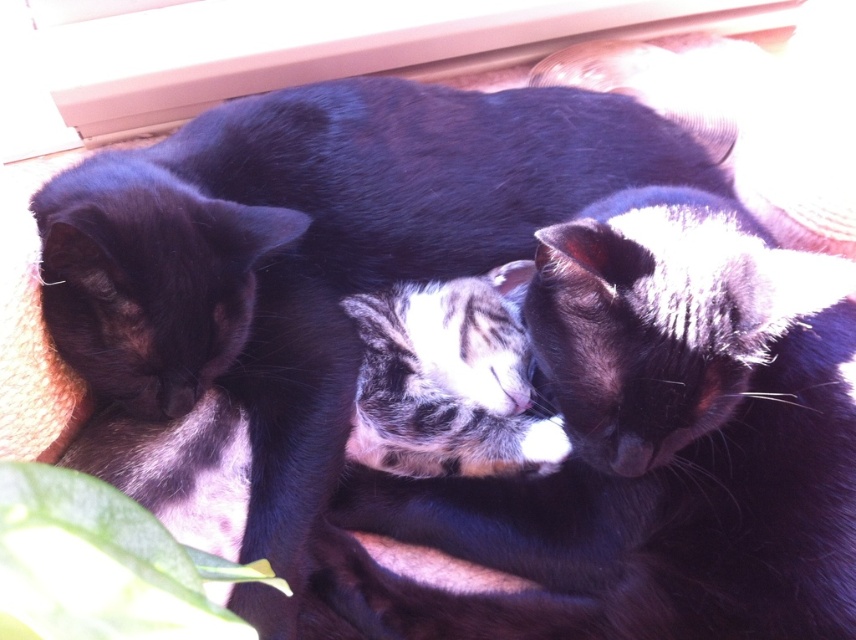
Question: Considering the relative positions of smooth wood window sill at upper center and green leafy plant at lower left in the image provided, where is smooth wood window sill at upper center located with respect to green leafy plant at lower left?

Choices:
 (A) right
 (B) left

Answer: (A)

Question: Is the position of smooth wood window sill at upper center less distant than that of green leafy plant at lower left?

Choices:
 (A) no
 (B) yes

Answer: (A)

Question: Which object is closer to the camera taking this photo?

Choices:
 (A) green leafy plant at lower left
 (B) smooth wood window sill at upper center

Answer: (A)

Question: Does smooth wood window sill at upper center appear on the left side of green leafy plant at lower left?

Choices:
 (A) no
 (B) yes

Answer: (A)

Question: Which object appears farthest from the camera in this image?

Choices:
 (A) smooth wood window sill at upper center
 (B) green leafy plant at lower left

Answer: (A)